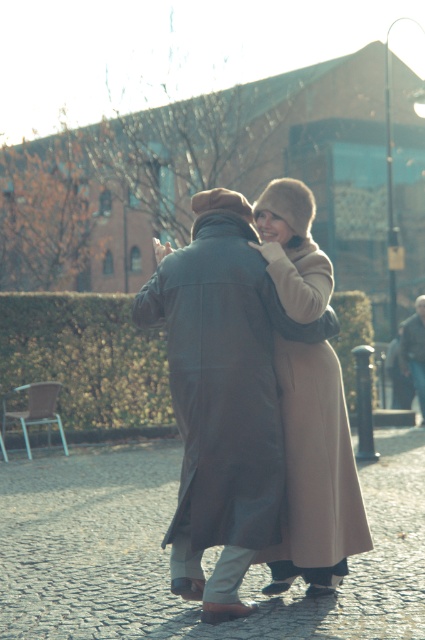
Question: Is beige wool coat at center closer to the viewer compared to leather jacket at center?

Choices:
 (A) no
 (B) yes

Answer: (B)

Question: Among these objects, which one is farthest from the camera?

Choices:
 (A) beige wool coat at center
 (B) leather coat at center
 (C) leather jacket at center

Answer: (C)

Question: Can you confirm if beige wool coat at center is wider than leather jacket at center?

Choices:
 (A) no
 (B) yes

Answer: (B)

Question: Does beige wool coat at center appear on the right side of leather jacket at center?

Choices:
 (A) yes
 (B) no

Answer: (B)

Question: Which is farther from the beige wool coat at center?

Choices:
 (A) leather coat at center
 (B) leather jacket at center

Answer: (B)

Question: Which object is the farthest from the leather jacket at center?

Choices:
 (A) leather coat at center
 (B) beige wool coat at center

Answer: (A)